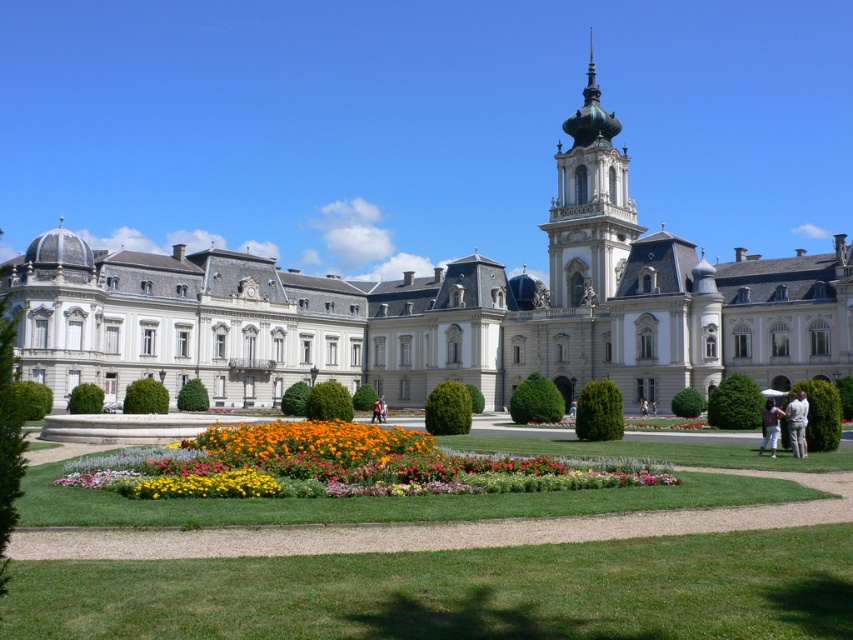
Looking at this image, you are standing in a garden and want to take a photo of the white stone palace at center. If your camera can capture objects up to 80 meters away, will you be able to take the photo clearly?

The white stone palace at center and camera are 82.44 meters apart from each other. Since the distance exceeds the camera maximum range of 80 meters, the camera cannot capture the white stone palace at center clearly.

You are standing in the garden in front of the grand building. You see the white stone palace at center and the green grass at center. Which object is positioned to the left?

The white stone palace at center is positioned to the left of the green grass at center.